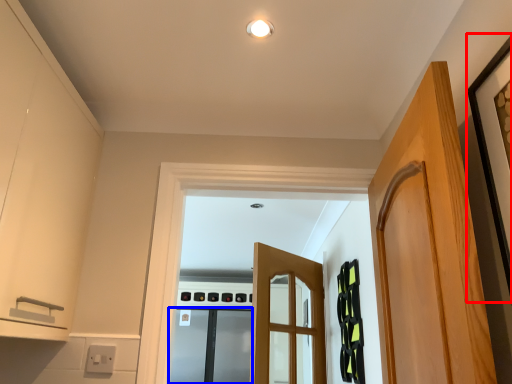
Question: Which object appears closest to the camera in this image, picture frame (highlighted by a red box) or screen door (highlighted by a blue box)?

Choices:
 (A) picture frame
 (B) screen door

Answer: (A)